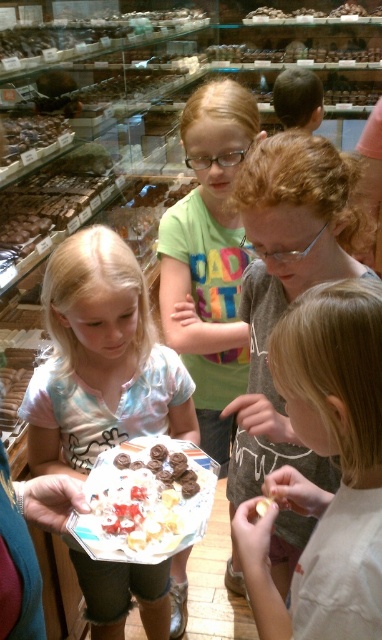
You are a delivery person who needs to place a 15 inch wide package on the table where there is a green cotton shirt at center and a white creamy cake at center. Can you fit the package between them without moving either object?

The distance between the green cotton shirt at center and the white creamy cake at center is 20.07 inches. Since the package is 15 inches wide, it can fit between them as there is enough space.

Please look at the point located at coordinates [328,456]. What can you see there?

At point [328,456] lies light brown hair at center.